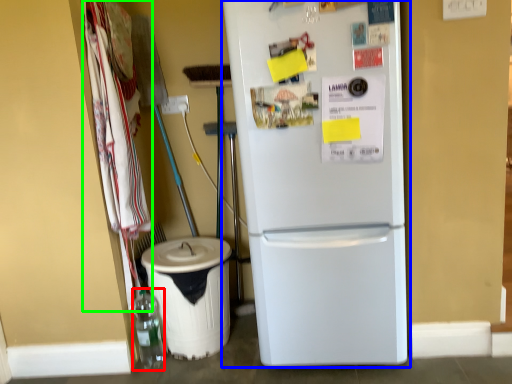
Question: Based on their relative distances, which object is nearer to bottle (highlighted by a red box)? Choose from refrigerator (highlighted by a blue box) and laundry (highlighted by a green box).

Choices:
 (A) refrigerator
 (B) laundry

Answer: (B)